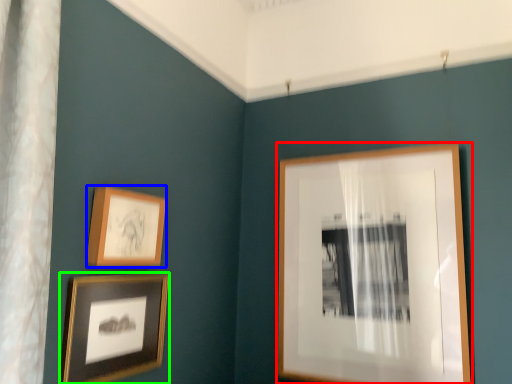
Question: Which is farther away from picture frame (highlighted by a red box)? picture frame (highlighted by a blue box) or picture frame (highlighted by a green box)?

Choices:
 (A) picture frame
 (B) picture frame

Answer: (A)